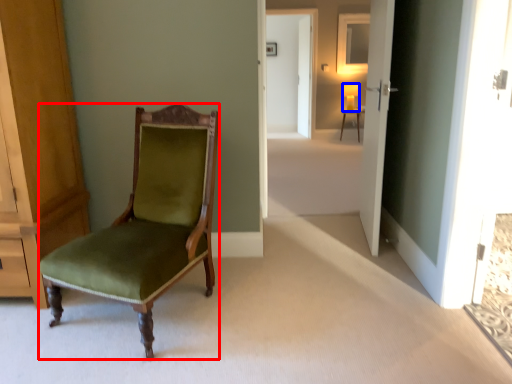
Question: Which object is further to the camera taking this photo, chair (highlighted by a red box) or lamp (highlighted by a blue box)?

Choices:
 (A) chair
 (B) lamp

Answer: (B)